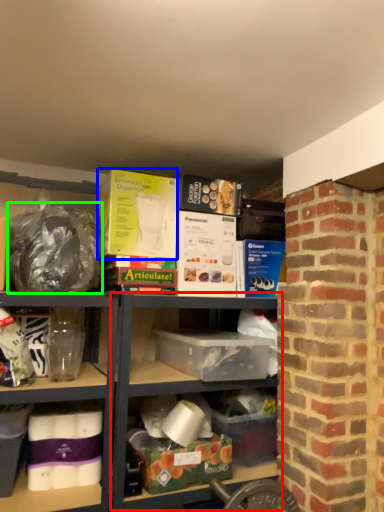
Question: Based on their relative distances, which object is nearer to shelf (highlighted by a red box)? Choose from box (highlighted by a blue box) and waste (highlighted by a green box).

Choices:
 (A) box
 (B) waste

Answer: (B)